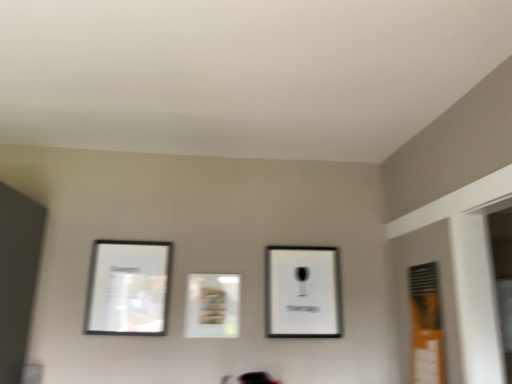
Question: Is matte white picture frame at center, which is counted as the 2th picture frame, starting from the left, inside or outside of orange matte window at right?

Choices:
 (A) outside
 (B) inside

Answer: (A)

Question: Is matte white picture frame at center, which is counted as the 2th picture frame, starting from the left, bigger or smaller than orange matte window at right?

Choices:
 (A) big
 (B) small

Answer: (B)

Question: Which is farther from the matte white picture frame at center, which is counted as the 2th picture frame, starting from the left?

Choices:
 (A) black matte picture frame at upper center, positioned as the first picture frame in right-to-left order
 (B) matte black picture frame at left, which is the third picture frame from right to left
 (C) orange matte window at right

Answer: (C)

Question: Considering the real-world distances, which object is farthest from the matte white picture frame at center, which ranks as the second picture frame in right-to-left order?

Choices:
 (A) orange matte window at right
 (B) matte black picture frame at left, marked as the 1th picture frame in a left-to-right arrangement
 (C) black matte picture frame at upper center, which is the third picture frame from left to right

Answer: (A)